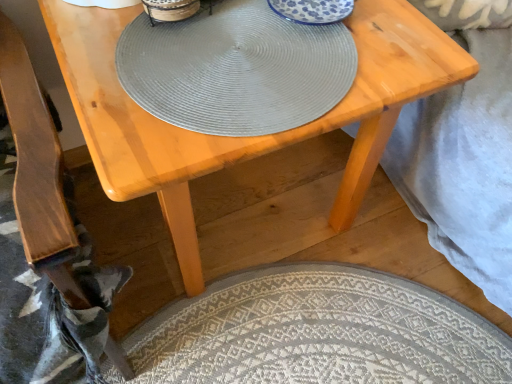
Question: Is matte gray placemat at center located within wooden armchair at lower left?

Choices:
 (A) yes
 (B) no

Answer: (B)

Question: Does wooden armchair at lower left have a greater height compared to matte gray placemat at center?

Choices:
 (A) no
 (B) yes

Answer: (B)

Question: Is wooden armchair at lower left with matte gray placemat at center?

Choices:
 (A) yes
 (B) no

Answer: (B)

Question: Does wooden armchair at lower left appear on the left side of matte gray placemat at center?

Choices:
 (A) yes
 (B) no

Answer: (A)

Question: From a real-world perspective, is wooden armchair at lower left located higher than matte gray placemat at center?

Choices:
 (A) yes
 (B) no

Answer: (B)

Question: Does wooden armchair at lower left have a lesser height compared to matte gray placemat at center?

Choices:
 (A) yes
 (B) no

Answer: (B)

Question: Is light wood table at center at the right side of matte gray placemat at center?

Choices:
 (A) yes
 (B) no

Answer: (A)

Question: Is light wood table at center further to camera compared to matte gray placemat at center?

Choices:
 (A) no
 (B) yes

Answer: (A)

Question: Is light wood table at center facing away from matte gray placemat at center?

Choices:
 (A) no
 (B) yes

Answer: (A)

Question: From the image's perspective, is light wood table at center on matte gray placemat at center?

Choices:
 (A) no
 (B) yes

Answer: (A)

Question: Is light wood table at center oriented towards matte gray placemat at center?

Choices:
 (A) yes
 (B) no

Answer: (B)

Question: Is light wood table at center not inside matte gray placemat at center?

Choices:
 (A) yes
 (B) no

Answer: (A)

Question: From the image's perspective, does matte gray placemat at center appear lower than wooden armchair at lower left?

Choices:
 (A) yes
 (B) no

Answer: (B)